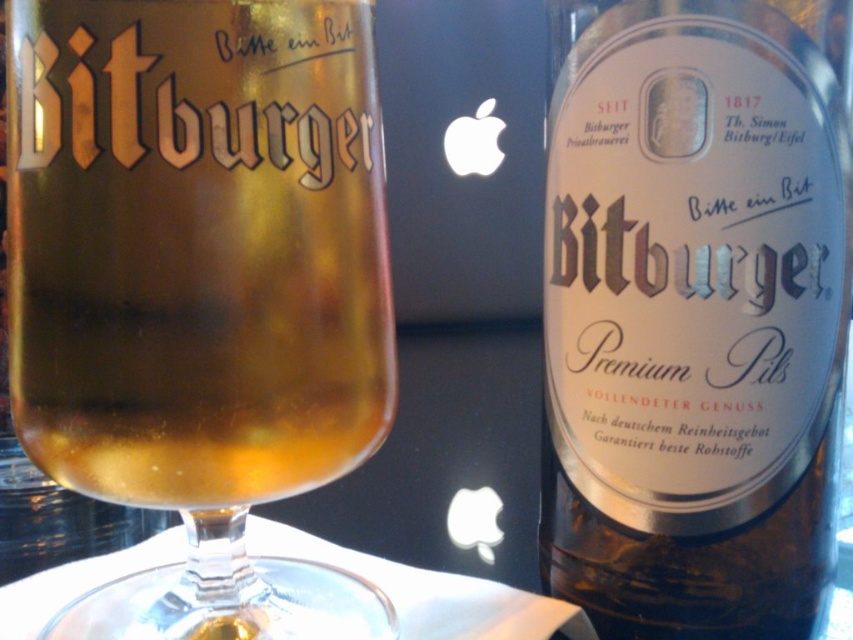
Which is more to the right, translucent glass beer glass at center or translucent glass bottle at center?

From the viewer's perspective, translucent glass bottle at center appears more on the right side.

Locate an element on the screen. Image resolution: width=853 pixels, height=640 pixels. translucent glass beer glass at center is located at coordinates (200, 289).

Who is more forward, (236, 305) or (637, 385)?

Point (236, 305) is in front.

Identify the location of translucent glass beer glass at center. Image resolution: width=853 pixels, height=640 pixels. (200, 289).